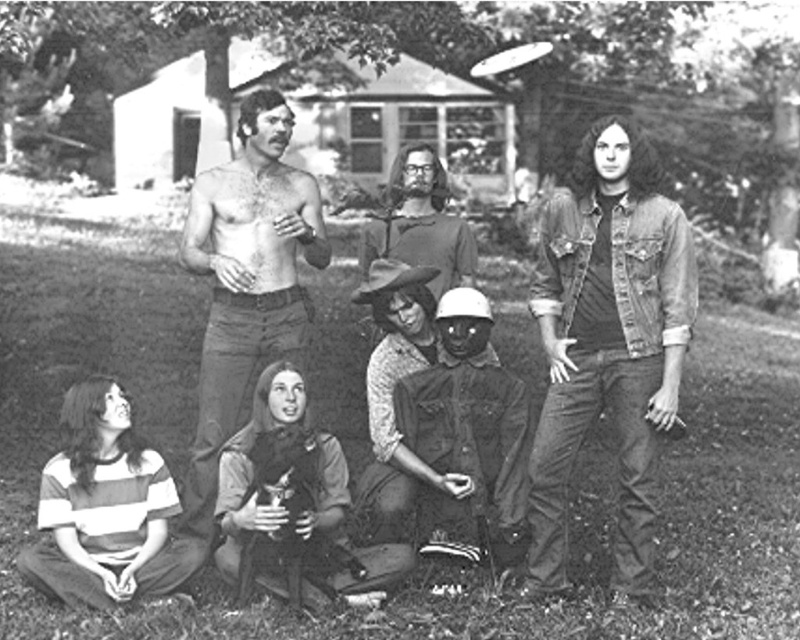
Question: From the image, what is the correct spatial relationship of grass at lower center in relation to denim jacket at center?

Choices:
 (A) below
 (B) above

Answer: (A)

Question: Which is farther from the denim shirt at center?

Choices:
 (A) grass at lower center
 (B) shiny skin torso at center
 (C) denim jacket at center

Answer: (A)

Question: Does grass at lower center have a larger size compared to shiny skin torso at center?

Choices:
 (A) yes
 (B) no

Answer: (A)

Question: Which object appears farthest from the camera in this image?

Choices:
 (A) grass at lower center
 (B) denim jacket at center

Answer: (B)

Question: Can you confirm if denim shirt at center is wider than denim jacket at center?

Choices:
 (A) no
 (B) yes

Answer: (B)

Question: Estimate the real-world distances between objects in this image. Which object is closer to the denim shirt at center?

Choices:
 (A) denim jacket at center
 (B) shiny skin torso at center
 (C) grass at lower center

Answer: (A)